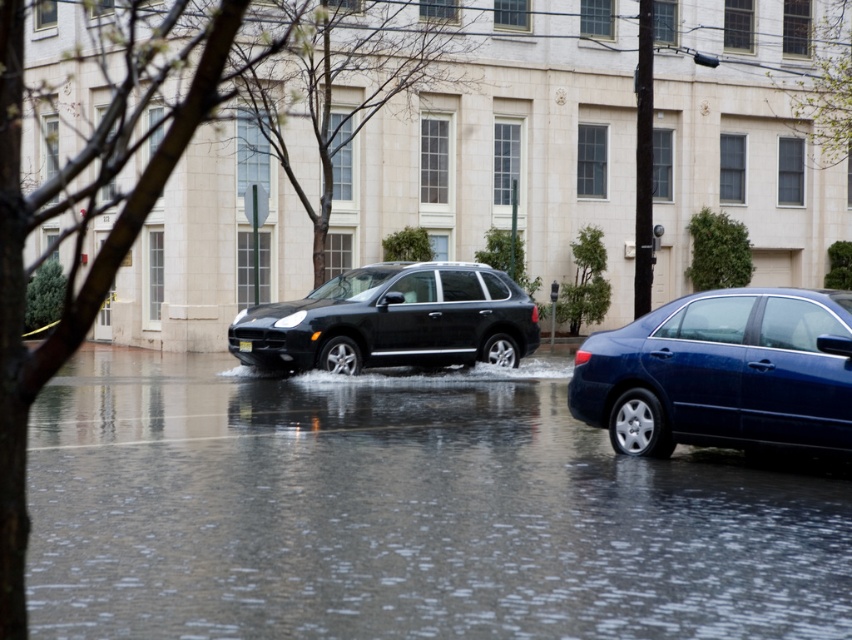
You are a pedestrian trying to cross the flooded street. You see the clear water at road center and the matte black suv at center. Which object is lower in position?

The clear water at road center is below the matte black suv at center, so the clear water at road center is lower in position.

You are a pedestrian trying to cross the flooded street. You see the clear water at road center and the glossy blue sedan at right. Which object is lower in the scene?

The clear water at road center is below the glossy blue sedan at right, so the clear water at road center is lower in the scene.